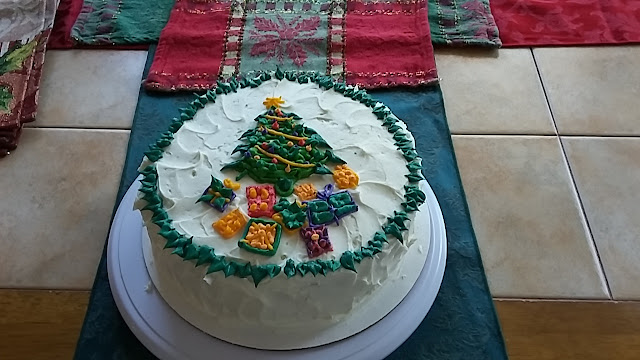
Where is `decorative cloth napkins`? This screenshot has width=640, height=360. decorative cloth napkins is located at coordinates (18, 110), (6, 17), (50, 9), (31, 107).